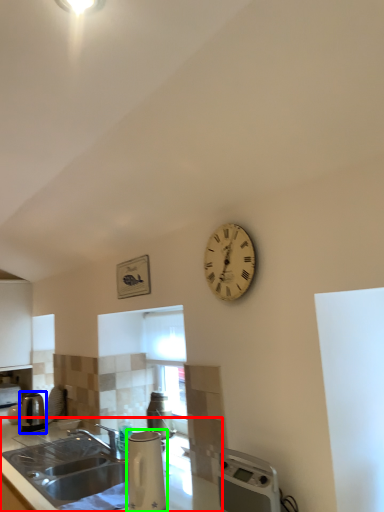
Question: Estimate the real-world distances between objects in this image. Which object is closer to countertop (highlighted by a red box), kitchen appliance (highlighted by a blue box) or appliance (highlighted by a green box)?

Choices:
 (A) kitchen appliance
 (B) appliance

Answer: (A)